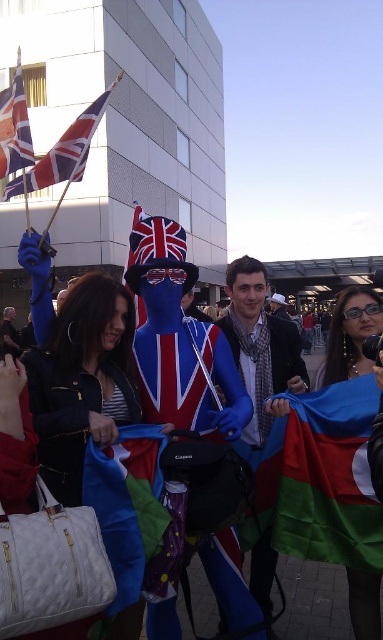
Question: Does polyester flag at center have a lesser width compared to union jack fabric flag at upper left?

Choices:
 (A) yes
 (B) no

Answer: (A)

Question: Which point is closer to the camera?

Choices:
 (A) (225, 273)
 (B) (291, 419)

Answer: (B)

Question: Is polyester flag at center further to the viewer compared to union jack flag at center?

Choices:
 (A) yes
 (B) no

Answer: (B)

Question: Which point is farther from the camera taking this photo?

Choices:
 (A) (319, 460)
 (B) (91, 124)

Answer: (B)

Question: Which object is positioned farthest from the union jack fabric flag at upper left?

Choices:
 (A) polyester flag at center
 (B) blue fabric jacket at center

Answer: (B)

Question: Does polyester flag at center come behind union jack fabric flag at upper left?

Choices:
 (A) no
 (B) yes

Answer: (A)